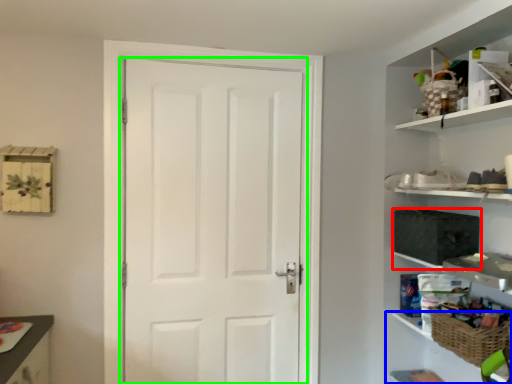
Question: Based on their relative distances, which object is farther from medicine cabinet (highlighted by a red box)? Choose from cabinet (highlighted by a blue box) and door (highlighted by a green box).

Choices:
 (A) cabinet
 (B) door

Answer: (B)